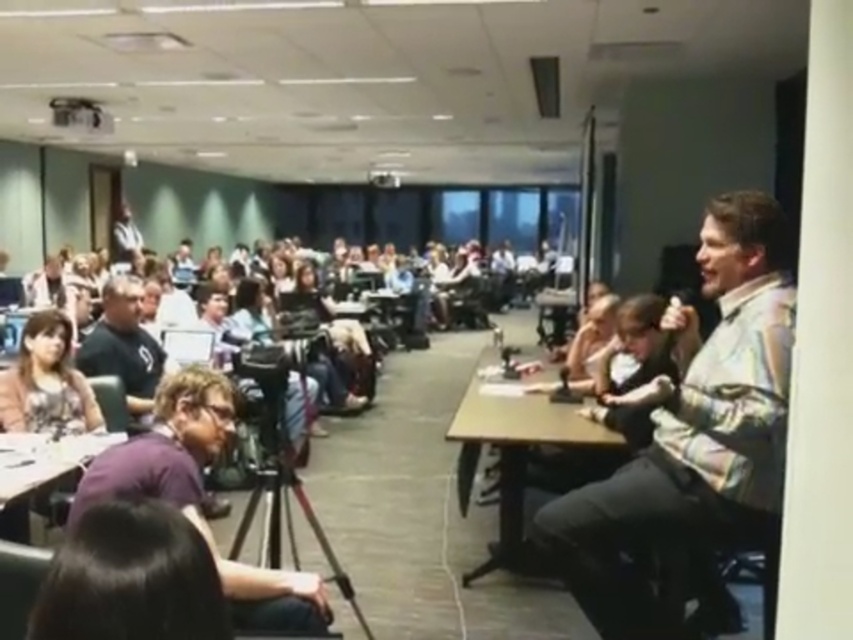
Is the position of camouflage shirt at right less distant than that of purple fabric shirt at lower left?

No, it is behind purple fabric shirt at lower left.

Locate an element on the screen. The height and width of the screenshot is (640, 853). camouflage shirt at right is located at coordinates (692, 438).

Find the location of a particular element. Image resolution: width=853 pixels, height=640 pixels. camouflage shirt at right is located at coordinates (692, 438).

The height and width of the screenshot is (640, 853). I want to click on camouflage shirt at right, so click(692, 438).

Consider the image. Can you confirm if brown wooden table at center is positioned to the left of wooden table at lower left?

No, brown wooden table at center is not to the left of wooden table at lower left.

Who is positioned more to the right, brown wooden table at center or wooden table at lower left?

brown wooden table at center is more to the right.

Is point (460, 429) positioned after point (51, 449)?

That is True.

The image size is (853, 640). I want to click on brown wooden table at center, so click(x=514, y=452).

Can you confirm if purple fabric shirt at lower left is positioned above wooden table at lower left?

Indeed, purple fabric shirt at lower left is positioned over wooden table at lower left.

Between point (216, 417) and point (28, 458), which one is positioned in front?

Point (216, 417)

Between point (254, 600) and point (125, 436), which one is positioned in front?

Point (254, 600)

You are a GUI agent. You are given a task and a screenshot of the screen. Output one action in this format:
    pyautogui.click(x=<x>, y=<y>)
    Task: Click on the purple fabric shirt at lower left
    Image resolution: width=853 pixels, height=640 pixels.
    Given the screenshot: What is the action you would take?
    pyautogui.click(x=201, y=493)